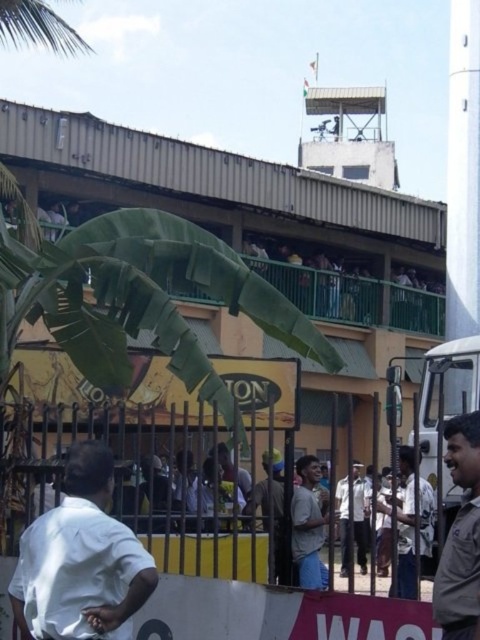
You are standing at the entrance of the stadium and see the brown leather jacket at lower right. If you want to reach it quickly, should you walk towards the fence or away from it?

The brown leather jacket at lower right is 77.99 feet from viewer, so you should walk towards the fence to reach it quickly.

You are a photographer at the stadium. You want to take a photo of both the brown leather jacket at lower right and the dark gray shirt at center. Which object should you focus on first to ensure both are in sharp focus?

The brown leather jacket at lower right is closer to the viewer than the dark gray shirt at center. To ensure both are in sharp focus, you should focus on the brown leather jacket at lower right first, as focusing on the closer object will help achieve focus on the farther one as well.

You are standing at the point labeled point (99, 451) and want to walk to the point labeled point (302, 570). Which direction should you move in to get closer to your destination?

To move from point (99, 451) to point (302, 570), you should move towards the right and upwards since point (302, 570) is located to the right and above point (99, 451).